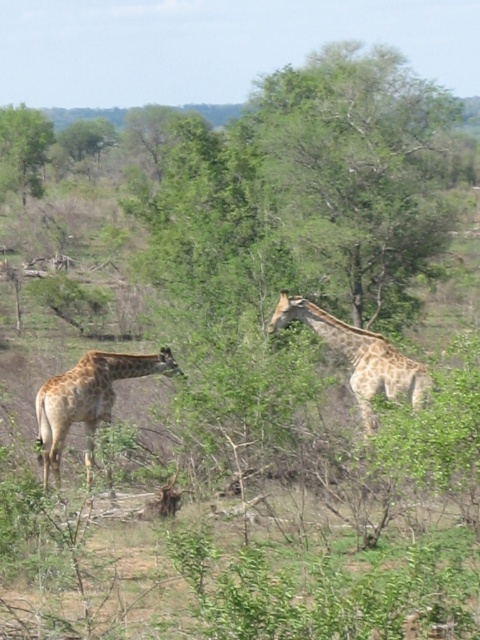
Question: Based on their relative distances, which object is nearer to the spotted fur giraffe at left?

Choices:
 (A) spotted fur giraffe at center
 (B) green leafy tree at upper left

Answer: (A)

Question: Is spotted fur giraffe at center smaller than green leafy tree at upper left?

Choices:
 (A) no
 (B) yes

Answer: (B)

Question: Which point appears farthest from the camera in this image?

Choices:
 (A) (27, 128)
 (B) (101, 380)
 (C) (332, 328)

Answer: (A)

Question: Estimate the real-world distances between objects in this image. Which object is farther from the green leafy tree at upper left?

Choices:
 (A) spotted fur giraffe at center
 (B) spotted fur giraffe at left

Answer: (B)

Question: From the image, what is the correct spatial relationship of spotted fur giraffe at left in relation to spotted fur giraffe at center?

Choices:
 (A) left
 (B) right

Answer: (A)

Question: Does spotted fur giraffe at left have a larger size compared to green leafy tree at upper left?

Choices:
 (A) yes
 (B) no

Answer: (B)